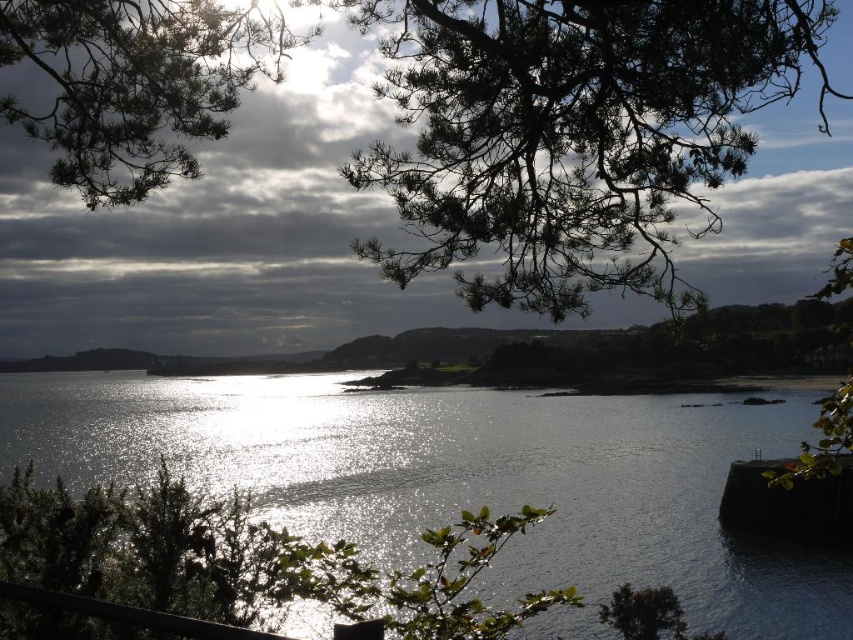
Does shiny reflective water at center appear on the left side of dark green pine branches at upper center?

Yes, shiny reflective water at center is to the left of dark green pine branches at upper center.

Image resolution: width=853 pixels, height=640 pixels. I want to click on shiny reflective water at center, so click(463, 480).

Which of these two, dark green pine branches at upper center or green needle-like branches at upper left, stands shorter?

green needle-like branches at upper left is shorter.

Is the position of dark green pine branches at upper center more distant than that of green needle-like branches at upper left?

Yes, dark green pine branches at upper center is further from the viewer.

The width and height of the screenshot is (853, 640). Identify the location of dark green pine branches at upper center. (572, 132).

Is the position of shiny reflective water at center more distant than that of green needle-like branches at upper left?

Yes, shiny reflective water at center is behind green needle-like branches at upper left.

Who is positioned more to the right, shiny reflective water at center or green needle-like branches at upper left?

From the viewer's perspective, shiny reflective water at center appears more on the right side.

Locate an element on the screen. This screenshot has width=853, height=640. shiny reflective water at center is located at coordinates (463, 480).